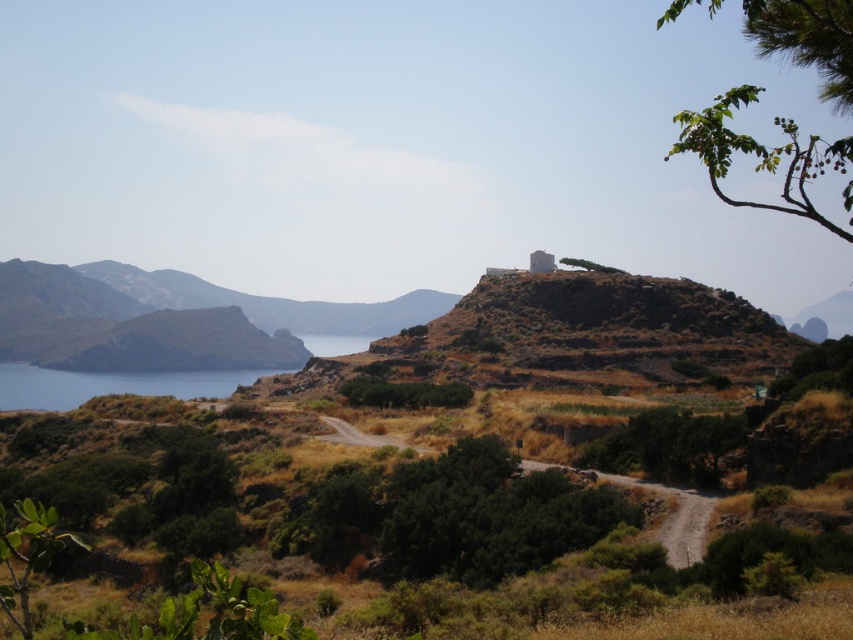
Question: Can you confirm if brown dirt road at center is bigger than green leafy tree at center?

Choices:
 (A) no
 (B) yes

Answer: (B)

Question: Considering the real-world distances, which object is farthest from the green leafy branch at upper right?

Choices:
 (A) blue water at lower left
 (B) brown dirt road at center
 (C) green leafy tree at center

Answer: (A)

Question: Which object is the closest to the blue water at lower left?

Choices:
 (A) green leafy tree at upper center
 (B) brown dirt road at center

Answer: (A)

Question: Which is farther from the brown dirt road at center?

Choices:
 (A) green leafy tree at center
 (B) brown rocky mountain at left

Answer: (B)

Question: Does green leafy branch at upper right have a greater width compared to brown dirt road at center?

Choices:
 (A) no
 (B) yes

Answer: (B)

Question: Observing the image, what is the correct spatial positioning of green leafy branch at upper right in reference to green leafy tree at upper center?

Choices:
 (A) below
 (B) above

Answer: (B)